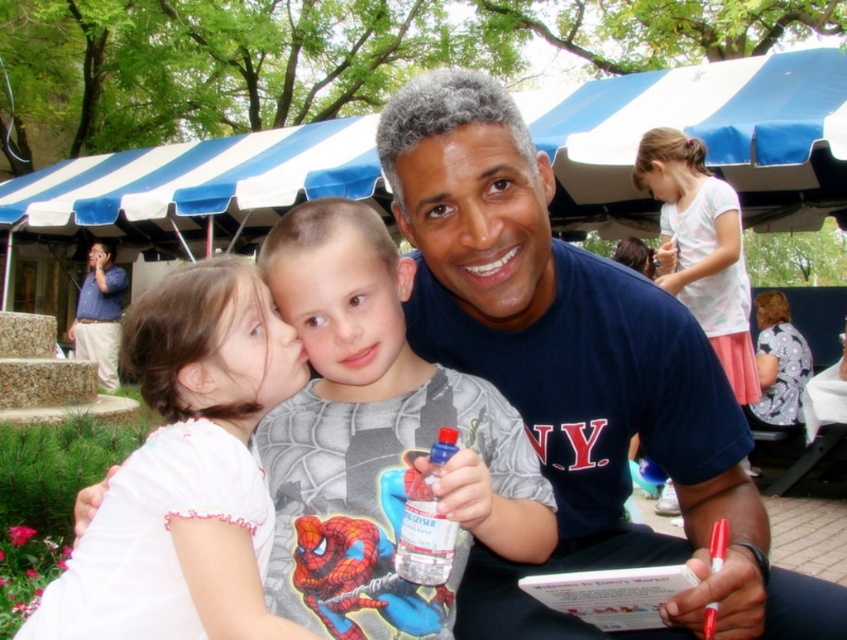
Is white cotton shirt at upper left thinner than clear plastic bottle at center?

No.

Between point (214, 593) and point (454, 529), which one is positioned behind?

Positioned behind is point (214, 593).

Identify the location of white cotton shirt at upper left. (187, 472).

Can you confirm if white cotton shirt at upper left is shorter than blue shirt at left?

Correct, white cotton shirt at upper left is not as tall as blue shirt at left.

Between white cotton shirt at upper left and blue shirt at left, which one is positioned higher?

blue shirt at left is above.

Does point (165, 275) lie behind point (113, 312)?

No, it is not.

The image size is (847, 640). Find the location of `white cotton shirt at upper left`. white cotton shirt at upper left is located at coordinates (187, 472).

Between point (446, 458) and point (109, 296), which one is positioned behind?

Point (109, 296)

Which is more to the left, clear plastic bottle at center or blue shirt at left?

blue shirt at left is more to the left.

In order to click on clear plastic bottle at center in this screenshot , I will do coord(427,524).